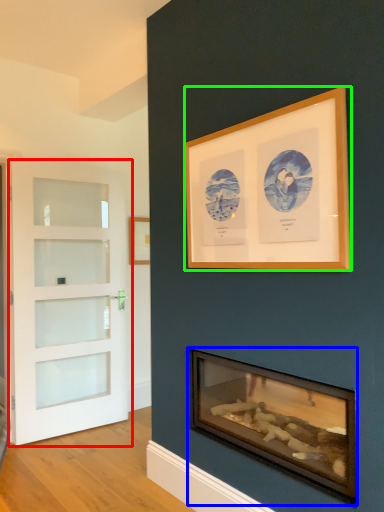
Question: Estimate the real-world distances between objects in this image. Which object is closer to door (highlighted by a red box), wood burning stove (highlighted by a blue box) or picture frame (highlighted by a green box)?

Choices:
 (A) wood burning stove
 (B) picture frame

Answer: (A)